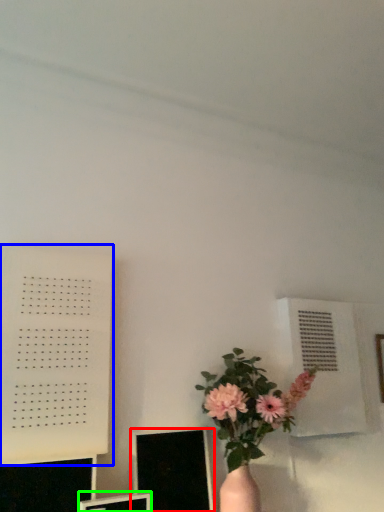
Question: Based on their relative distances, which object is farther from computer monitor (highlighted by a red box)? Choose from bulletin board (highlighted by a blue box) and computer monitor (highlighted by a green box).

Choices:
 (A) bulletin board
 (B) computer monitor

Answer: (A)